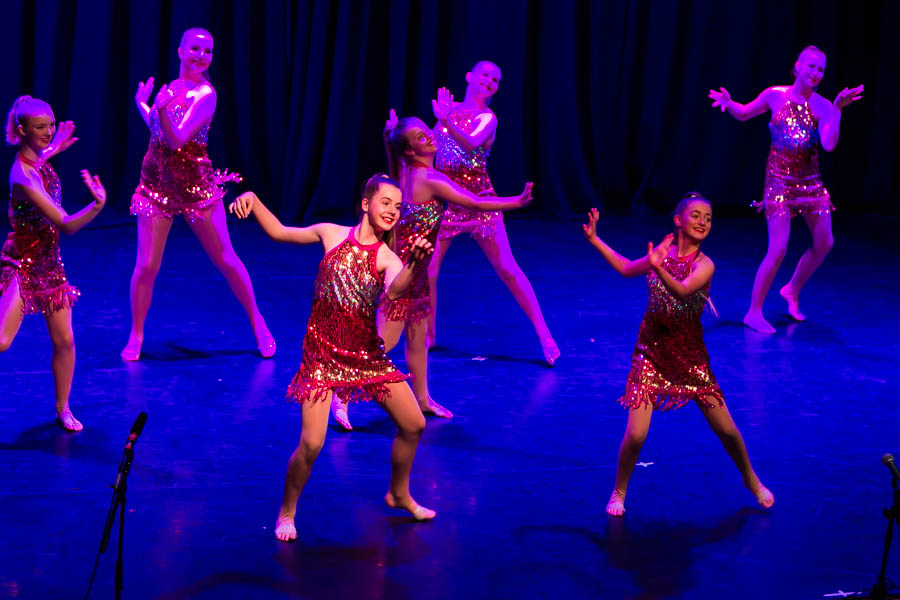
Where is `stage floor`? The width and height of the screenshot is (900, 600). stage floor is located at coordinates (518, 457).